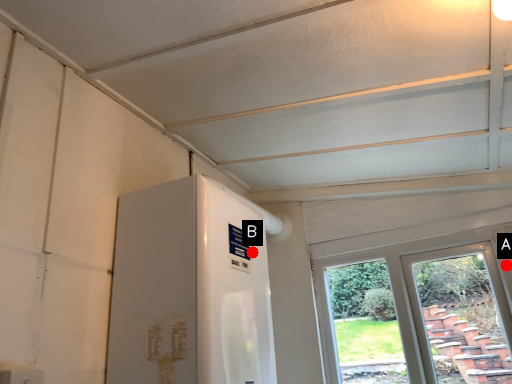
Question: Two points are circled on the image, labeled by A and B beside each circle. Among these points, which one is nearest to the camera?

Choices:
 (A) A is closer
 (B) B is closer

Answer: (B)